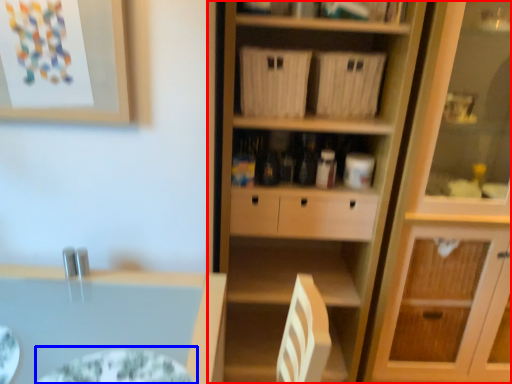
Question: Which point is further to the camera, cupboard (highlighted by a red box) or glass plate (highlighted by a blue box)?

Choices:
 (A) cupboard
 (B) glass plate

Answer: (A)